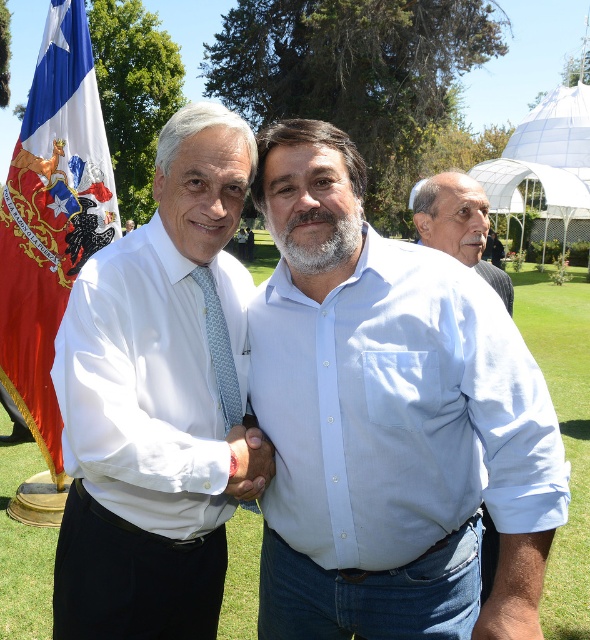
You are a photographer at the event and need to frame a shot that includes both the white cotton shirt at center and the gray hair at upper right. Which object should you adjust your camera to focus on first to ensure it fits within the frame?

The white cotton shirt at center is wider than the gray hair at upper right, so you should focus on framing the white cotton shirt at center first to ensure it fits, then adjust for the gray hair at upper right.

You are standing at the event and want to take a photo of the Chilean flag displayed on the left side. You notice a point marked at coordinates point (44, 97) that is 5.63 meters away from you. If your camera has a focal length of 50 mm and you want to capture the entire flag in your shot, would you need to zoom in or out from that point to ensure the flag fits within the frame?

Since the point (44, 97) is 5.63 meters away from you, and assuming the camera settings, you would need to zoom out to ensure the entire Chilean flag fits within the frame.